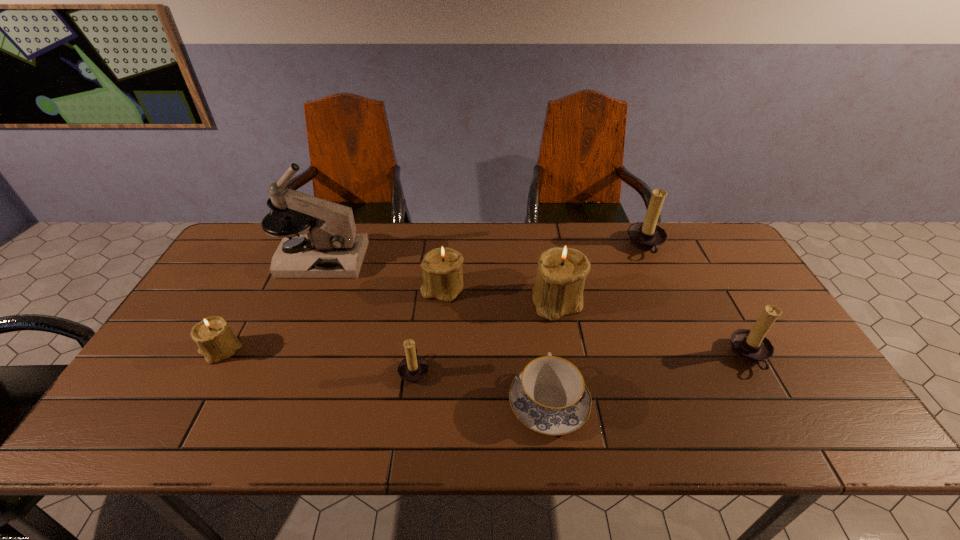
Identify the location of object that is at the left edge. (216, 341).

I want to click on object that is at the right edge, so click(x=751, y=346).

Image resolution: width=960 pixels, height=540 pixels. In order to click on vacant area at the far edge of the desktop in this screenshot , I will do `click(375, 248)`.

In the image, there is a desktop. Identify the location of vacant space at the right edge. The image size is (960, 540). (766, 376).

This screenshot has width=960, height=540. Find the location of `vacant space at the far left corner`. vacant space at the far left corner is located at coordinates (252, 230).

The height and width of the screenshot is (540, 960). I want to click on vacant space at the far right corner of the desktop, so click(681, 239).

Where is `free space at the near right corner of the desktop`? Image resolution: width=960 pixels, height=540 pixels. free space at the near right corner of the desktop is located at coordinates (799, 411).

Find the location of a particular element. empty space that is in between the rightmost candle holder and the rightmost beige candle_holder is located at coordinates [x=654, y=328].

You are a GUI agent. You are given a task and a screenshot of the screen. Output one action in this format:
    pyautogui.click(x=<x>, y=<y>)
    Task: Click on the unoccupied position between the second biggest brown candle holder and the smallest brown candle holder
    The width and height of the screenshot is (960, 540).
    Given the screenshot: What is the action you would take?
    pyautogui.click(x=583, y=363)

Identify the location of vacant area that lies between the biggest beige candle_holder and the second smallest brown candle holder. (654, 328).